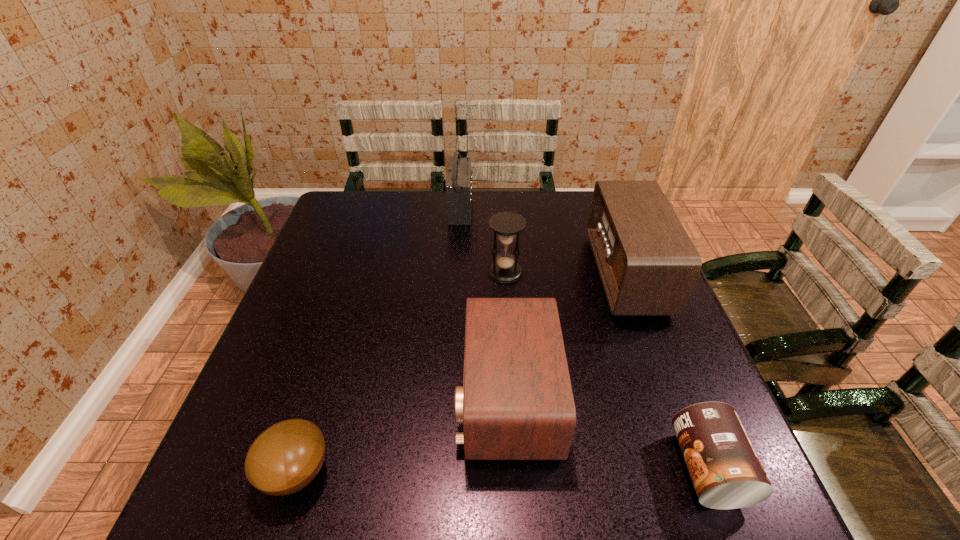
This screenshot has width=960, height=540. I want to click on vacant point at the near edge, so click(x=597, y=489).

Image resolution: width=960 pixels, height=540 pixels. In the image, there is a desktop. In order to click on vacant space at the left edge in this screenshot , I will do `click(304, 349)`.

Locate an element on the screen. free space at the right edge is located at coordinates (699, 380).

This screenshot has height=540, width=960. I want to click on vacant area between the nearest radio receiver and the second tallest radio receiver, so click(566, 336).

You are a GUI agent. You are given a task and a screenshot of the screen. Output one action in this format:
    pyautogui.click(x=<x>, y=<y>)
    Task: Click on the vacant area that lies between the fifth shortest object and the hourglass
    This screenshot has width=960, height=540.
    Given the screenshot: What is the action you would take?
    pyautogui.click(x=565, y=273)

Where is `empty location between the shortest object and the hourglass`? Image resolution: width=960 pixels, height=540 pixels. empty location between the shortest object and the hourglass is located at coordinates (400, 372).

This screenshot has height=540, width=960. I want to click on free space that is in between the shortest radio receiver and the fifth tallest object, so pyautogui.click(x=608, y=433).

You are a GUI agent. You are given a task and a screenshot of the screen. Output one action in this format:
    pyautogui.click(x=<x>, y=<y>)
    Task: Click on the vacant point located between the nearest radio receiver and the bowl
    
    Given the screenshot: What is the action you would take?
    pyautogui.click(x=402, y=435)

This screenshot has width=960, height=540. Identify the location of blank region between the farthest radio receiver and the bowl. (379, 340).

Identify the location of free spot between the shortest object and the nearest radio receiver. (402, 435).